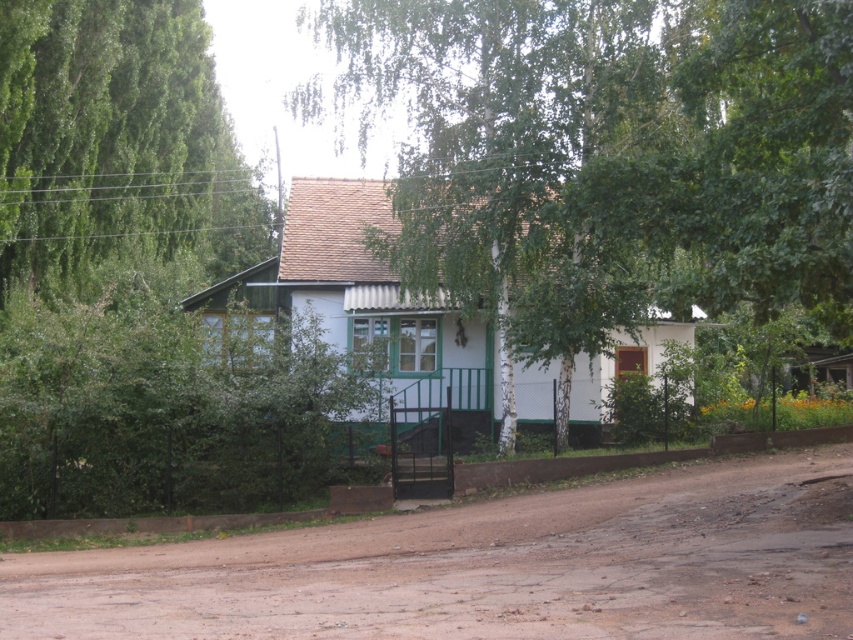
You are standing at the front door of the house and want to walk to a specific location. If you see two points marked in the image, one at coordinates point [706,294] and another at point [206,545], which point is closer to you as you face the house?

Point [706,294] is in front of point [206,545], so it is closer to you as you face the house.

You are standing in front of the house and want to walk along the brown dirt track at center. Which direction should you face to start walking along the track while keeping the green bark tree at center on your right side?

You should face towards the right side because the green bark tree at center is to the left of the brown dirt track at center, so facing right will keep the tree on your right as you walk along the track.